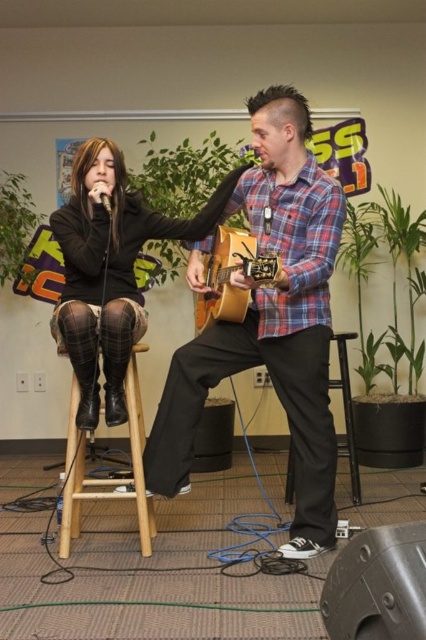
You are a photographer standing in front of the acoustic wood guitar at center. You want to take a closeup shot of the guitar, but you need to be at least 2 meters away to avoid disturbing the performers. Can you safely take the photo from your current position?

The distance between the acoustic wood guitar at center and the viewer is 1.98 meters. Since you need to be at least 2 meters away to avoid disturbing the performers, you are slightly too close. Move back a bit to ensure you maintain the required distance.

You are a photographer setting up a shoot in this music scene. You need to place a 1.2 meter tall tripod between the wooden stool at left and the brown plaid fabric chair at center. Will the tripod be taller than both objects?

The wooden stool at left has a greater height compared to brown plaid fabric chair at center. Since the tripod is 1.2 meters tall, we need to compare it to the taller object, which is the wooden stool at left. If the wooden stool at left is taller than 1.2 meters, then the tripod would not be taller than both. However, without specific measurements for the stool, we can only confirm that the tripod will be taller than the brown plaid fabric chair at center but cannot determine its relation to the stool.

In the scene shown: You are a photographer setting up for a live performance. You need to position a light source between the acoustic wood guitar at center and the brown plaid fabric chair at center. Based on their positions, which object should the light be closer to?

The acoustic wood guitar at center is in front of the brown plaid fabric chair at center, so the light should be positioned closer to the acoustic wood guitar at center to ensure it is well lit during the performance.